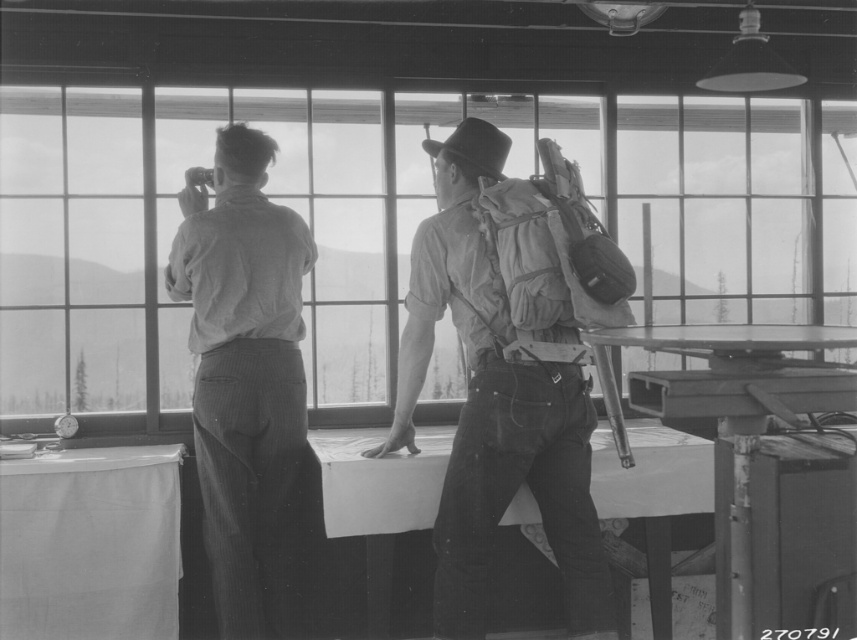
In the scene shown: You are standing at the entrance of the fire lookout tower and see two points marked in the image. If you walk straight towards the point at coordinates point (85, 582), will you pass by the other point point (447, 148) first?

Since point (85, 582) is behind point (447, 148), walking towards point (85, 582) would require passing by point (447, 148) first.

You are standing in the fire lookout tower and want to place a map on the surface closest to the window. Which object should you use, the white fabric table at lower left or the black felt cowboy hat at upper center?

The white fabric table at lower left is to the left of the black felt cowboy hat at upper center. Since the table is closer to the window, you should use the white fabric table at lower left to place the map.

You are a photographer planning to set up a tripod in the fire lookout tower. The tripod requires a flat surface that is not obstructed by the canvas backpack at center or the black felt cowboy hat at upper center. Based on the scene description, where should you place the tripod to ensure it is not blocked by either object?

The canvas backpack at center is below the black felt cowboy hat at upper center. To avoid obstruction, place the tripod on a flat surface above the canvas backpack at center but below the black felt cowboy hat at upper center, ensuring it is not blocked by either object.